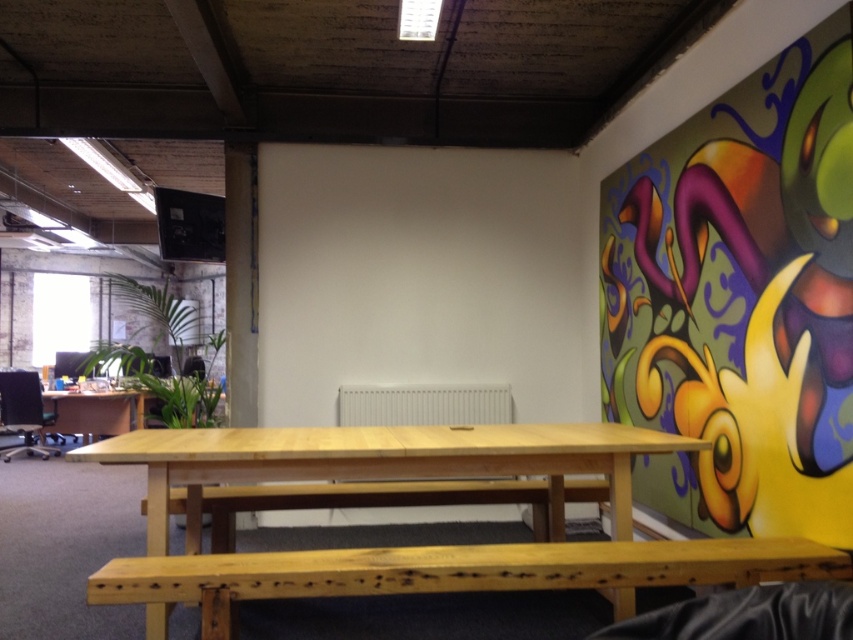
Does multicolored painted wall art at right appear on the left side of natural wood bench at lower center?

In fact, multicolored painted wall art at right is to the right of natural wood bench at lower center.

At what (x,y) coordinates should I click in order to perform the action: click on multicolored painted wall art at right. Please return your answer as a coordinate pair (x, y). This screenshot has width=853, height=640. Looking at the image, I should click on (741, 300).

Between point (728, 365) and point (595, 544), which one is positioned behind?

Point (728, 365)

The width and height of the screenshot is (853, 640). Find the location of `multicolored painted wall art at right`. multicolored painted wall art at right is located at coordinates (741, 300).

Based on the photo, does natural wood bench at lower center appear on the right side of natural wood bench at center?

Correct, you'll find natural wood bench at lower center to the right of natural wood bench at center.

At what (x,y) coordinates should I click in order to perform the action: click on natural wood bench at lower center. Please return your answer as a coordinate pair (x, y). The image size is (853, 640). Looking at the image, I should click on (454, 572).

Is the position of natural wood bench at lower center more distant than that of natural wood table at center?

No.

Between natural wood bench at lower center and natural wood table at center, which one has less height?

Standing shorter between the two is natural wood bench at lower center.

Between point (312, 592) and point (563, 445), which one is positioned in front?

Point (312, 592)

You are a GUI agent. You are given a task and a screenshot of the screen. Output one action in this format:
    pyautogui.click(x=<x>, y=<y>)
    Task: Click on the natural wood bench at lower center
    The width and height of the screenshot is (853, 640).
    Given the screenshot: What is the action you would take?
    pyautogui.click(x=454, y=572)